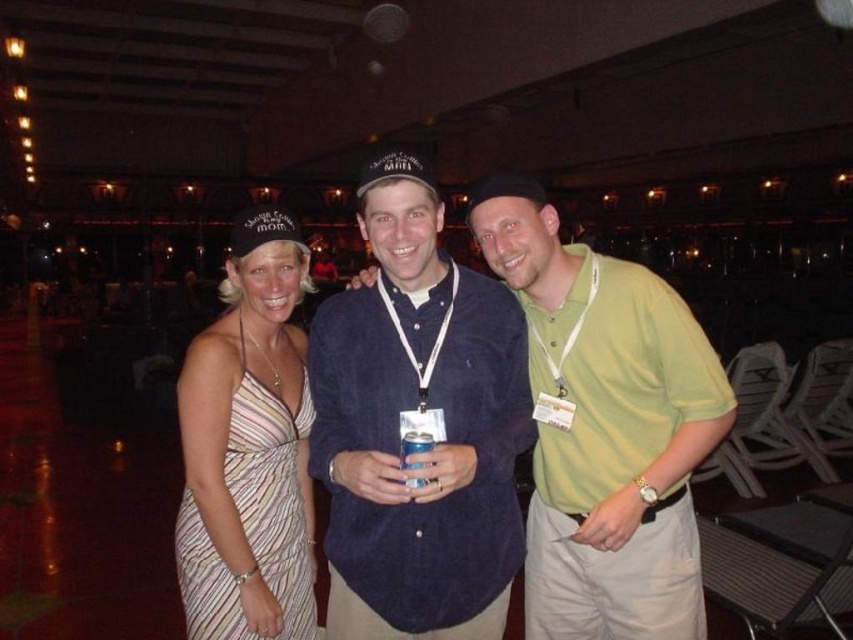
Describe the element at coordinates (418, 408) in the screenshot. I see `blue corduroy shirt at center` at that location.

Does point (380, 602) come in front of point (567, 412)?

That is True.

Which is behind, point (480, 404) or point (473, 200)?

Point (473, 200)

Where is `blue corduroy shirt at center`? The width and height of the screenshot is (853, 640). blue corduroy shirt at center is located at coordinates (418, 408).

Does point (294, 602) lie in front of point (405, 454)?

That is False.

Looking at this image, who is more forward, (265, 426) or (427, 433)?

Positioned in front is point (427, 433).

Is point (282, 404) positioned after point (407, 452)?

Yes, it is.

You are a GUI agent. You are given a task and a screenshot of the screen. Output one action in this format:
    pyautogui.click(x=<x>, y=<y>)
    Task: Click on the striped fabric dress at left
    This screenshot has height=640, width=853.
    Given the screenshot: What is the action you would take?
    pyautogui.click(x=248, y=449)

Measure the distance between striped fabric dress at center and blue corduroy shirt at center.

striped fabric dress at center and blue corduroy shirt at center are 2.93 inches apart.

Between point (415, 321) and point (427, 323), which one is positioned behind?

The point (415, 321) is more distant.

Describe the element at coordinates (421, 408) in the screenshot. The height and width of the screenshot is (640, 853). I see `striped fabric dress at center` at that location.

You are a GUI agent. You are given a task and a screenshot of the screen. Output one action in this format:
    pyautogui.click(x=<x>, y=<y>)
    Task: Click on the striped fabric dress at center
    
    Given the screenshot: What is the action you would take?
    pyautogui.click(x=421, y=408)